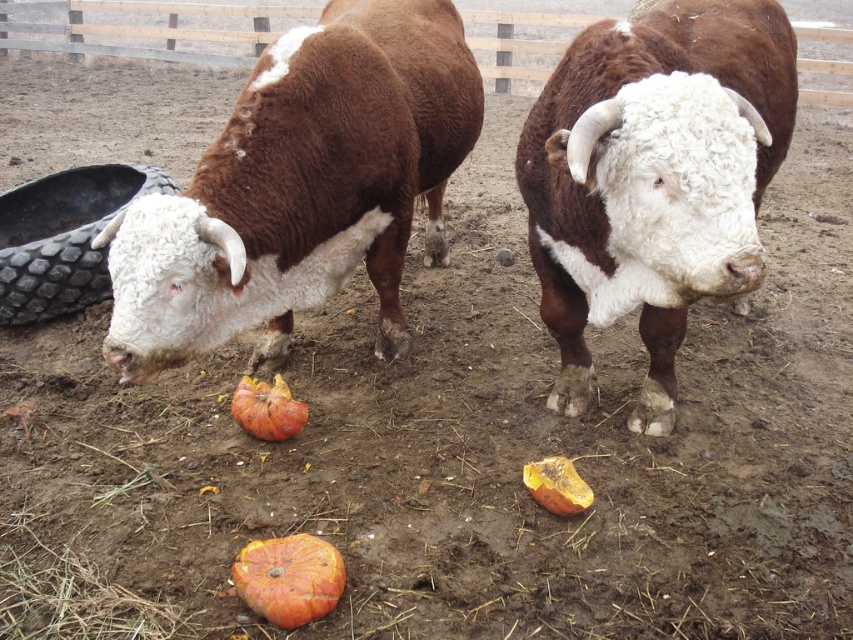
Question: Does orange rough pumpkin at center appear under rotten orange pumpkin at center?

Choices:
 (A) no
 (B) yes

Answer: (B)

Question: Estimate the real-world distances between objects in this image. Which object is closer to the brown woolly bull at left?

Choices:
 (A) brown woolly bull at center
 (B) orange rough pumpkin at center
 (C) black rubber tire at left

Answer: (A)

Question: Is brown woolly bull at left wider than black rubber tire at left?

Choices:
 (A) no
 (B) yes

Answer: (B)

Question: Among these points, which one is nearest to the camera?

Choices:
 (A) (303, 538)
 (B) (660, 378)
 (C) (242, 97)
 (D) (86, 196)

Answer: (A)

Question: Which point is closer to the camera?

Choices:
 (A) black rubber tire at left
 (B) orange matte pumpkin at center
 (C) brown woolly bull at center

Answer: (C)

Question: Is black rubber tire at left positioned before orange matte pumpkin at center?

Choices:
 (A) no
 (B) yes

Answer: (A)